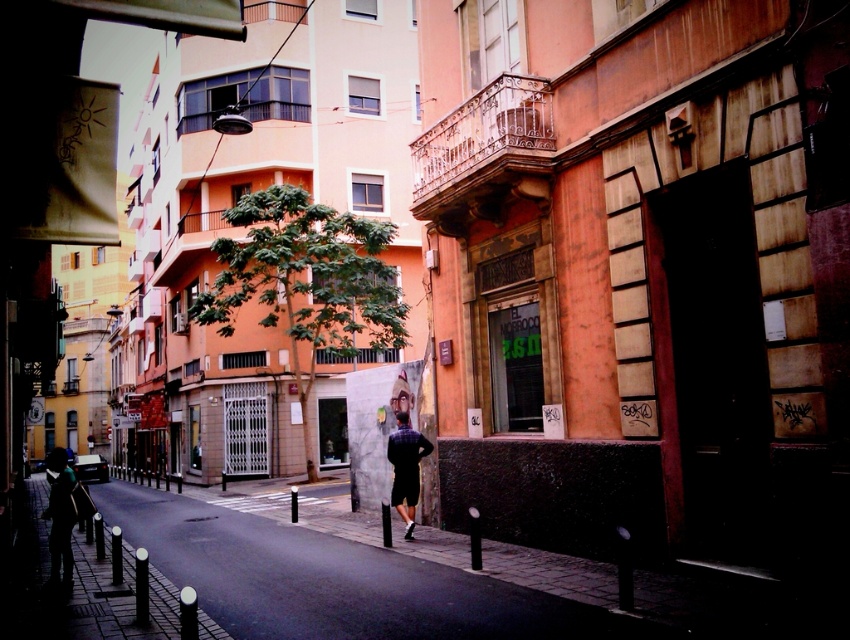
Between paved stone sidewalk at center and silhouette figure at left, which one has less height?

paved stone sidewalk at center

Is point (446, 634) farther from camera compared to point (68, 490)?

That is False.

Where is `paved stone sidewalk at center`? Image resolution: width=850 pixels, height=640 pixels. paved stone sidewalk at center is located at coordinates (338, 580).

Which is more to the left, silhouette figure at left or plaid fabric shirt at center?

From the viewer's perspective, silhouette figure at left appears more on the left side.

Can you confirm if silhouette figure at left is bigger than plaid fabric shirt at center?

Correct, silhouette figure at left is larger in size than plaid fabric shirt at center.

What are the coordinates of `silhouette figure at left` in the screenshot? It's located at (60, 516).

Is point (241, 589) more distant than point (397, 412)?

No, it is in front of (397, 412).

Measure the distance between paved stone sidewalk at center and camera.

A distance of 19.49 feet exists between paved stone sidewalk at center and camera.

Is point (267, 540) behind point (422, 449)?

That is True.

Identify the location of paved stone sidewalk at center. The width and height of the screenshot is (850, 640). (338, 580).